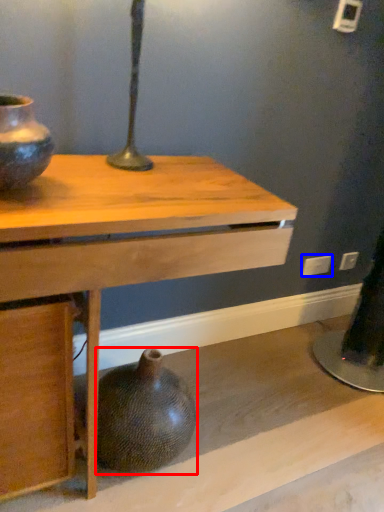
Question: Among these objects, which one is farthest to the camera, vase (highlighted by a red box) or electric outlet (highlighted by a blue box)?

Choices:
 (A) vase
 (B) electric outlet

Answer: (B)